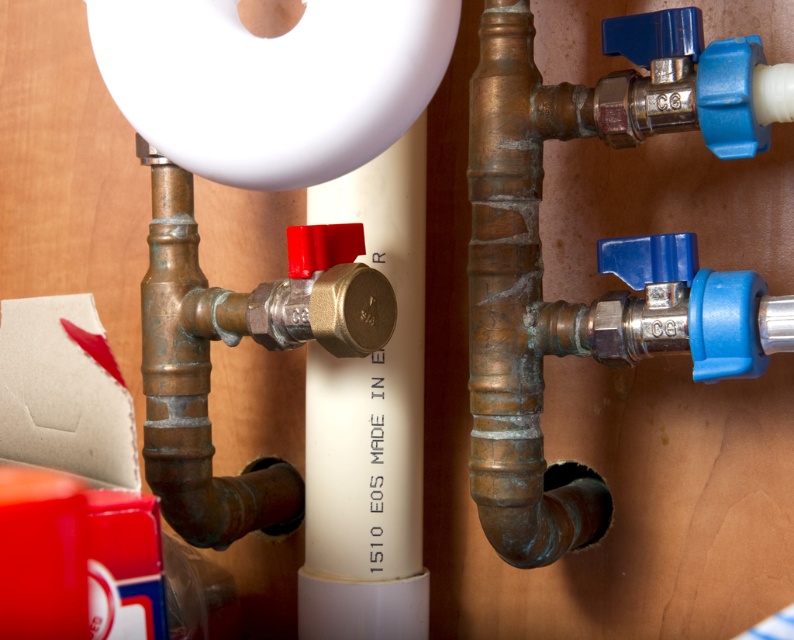
Looking at this image, does bronze copper pipe at center have a lesser height compared to brass water pipe at center?

No.

Is point (473, 282) less distant than point (336, 301)?

No, it is behind (336, 301).

Does point (744, 83) come closer to viewer compared to point (176, 280)?

That is True.

This screenshot has height=640, width=794. What are the coordinates of `bronze copper pipe at center` in the screenshot? It's located at (596, 250).